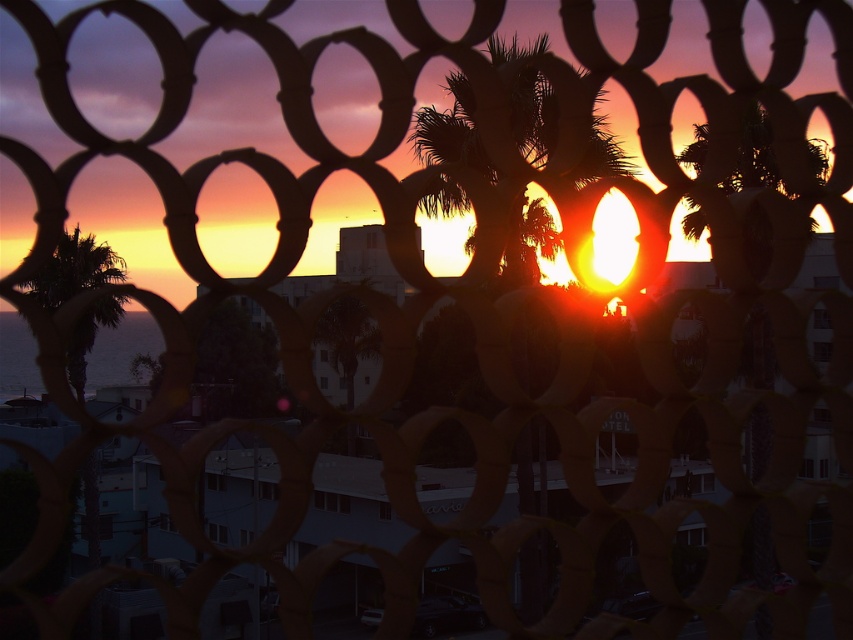
Question: Does silhouette leafy palm at center have a lesser width compared to green leafy palm tree at left?

Choices:
 (A) no
 (B) yes

Answer: (B)

Question: Is silhouette leafy palm at center above green leafy palm tree at left?

Choices:
 (A) no
 (B) yes

Answer: (B)

Question: Which of these objects is positioned farthest from the green leafy palm tree at left?

Choices:
 (A) silhouette leafy palm at center
 (B) dark blue water at lower left

Answer: (B)

Question: Considering the real-world distances, which object is farthest from the green leafy palm tree at left?

Choices:
 (A) dark blue water at lower left
 (B) silhouette leafy palm at center

Answer: (A)

Question: Estimate the real-world distances between objects in this image. Which object is farther from the green leafy palm tree at left?

Choices:
 (A) silhouette leafy palm at center
 (B) dark blue water at lower left

Answer: (B)

Question: Can you confirm if green leafy palm tree at left is smaller than dark blue water at lower left?

Choices:
 (A) no
 (B) yes

Answer: (B)